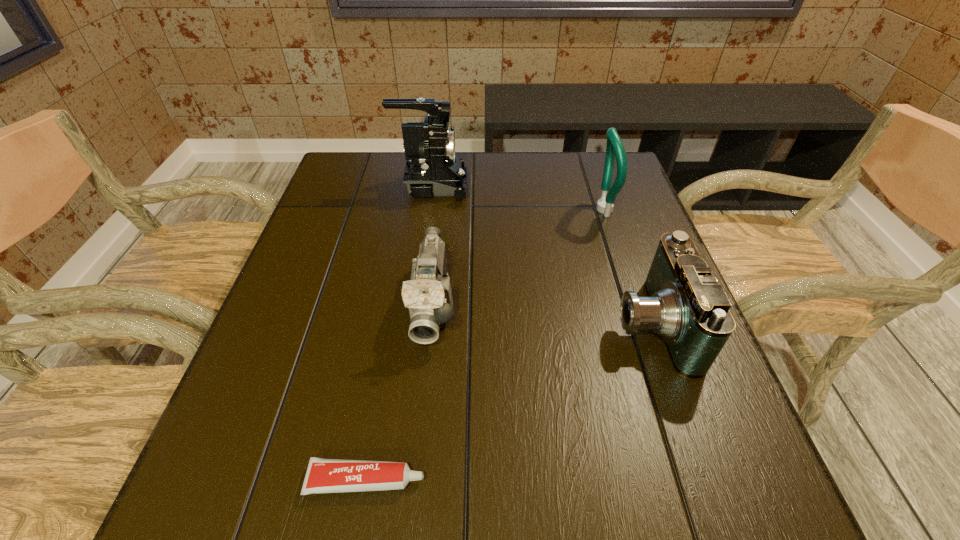
Where is `the tallest camcorder`? The width and height of the screenshot is (960, 540). the tallest camcorder is located at coordinates (433, 168).

You are a GUI agent. You are given a task and a screenshot of the screen. Output one action in this format:
    pyautogui.click(x=<x>, y=<y>)
    Task: Click on the bottle opener
    
    Given the screenshot: What is the action you would take?
    pyautogui.click(x=614, y=149)

The image size is (960, 540). I want to click on the rightmost camcorder, so click(685, 304).

Locate an element on the screen. toothpaste is located at coordinates (323, 475).

The height and width of the screenshot is (540, 960). I want to click on the nearest object, so click(323, 475).

Find the location of `vacant region located 0.400m on the lens mount of the tallest camcorder`. vacant region located 0.400m on the lens mount of the tallest camcorder is located at coordinates (610, 186).

Identify the location of free space located 0.390m at the jaws of the bottle opener. This screenshot has width=960, height=540. (444, 209).

Where is `vacant point located at the jaws of the bottle opener`? The image size is (960, 540). vacant point located at the jaws of the bottle opener is located at coordinates (447, 209).

The width and height of the screenshot is (960, 540). I want to click on vacant point located 0.390m at the jaws of the bottle opener, so click(x=444, y=209).

Locate an element on the screen. Image resolution: width=960 pixels, height=540 pixels. free space located on the front-facing side of the rightmost camcorder is located at coordinates (579, 324).